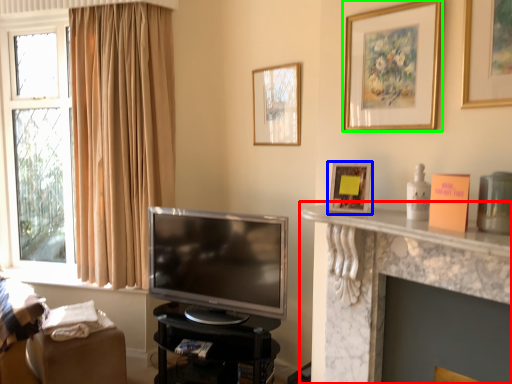
Question: Which is farther away from shelf (highlighted by a red box)? picture frame (highlighted by a blue box) or picture frame (highlighted by a green box)?

Choices:
 (A) picture frame
 (B) picture frame

Answer: (B)